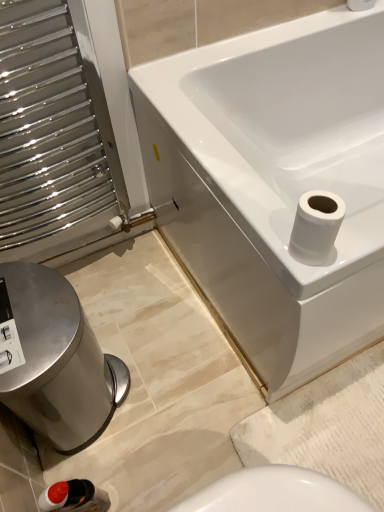
What are the coordinates of `free area behind matte black bottle at lower left` in the screenshot? It's located at (123, 462).